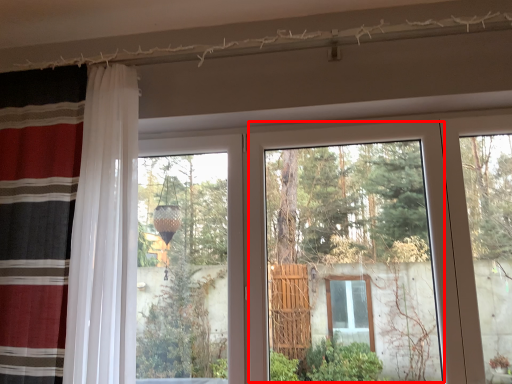
Question: From the image's perspective, what is the correct spatial relationship of glass door (annotated by the red box) in relation to curtain?

Choices:
 (A) below
 (B) above

Answer: (A)